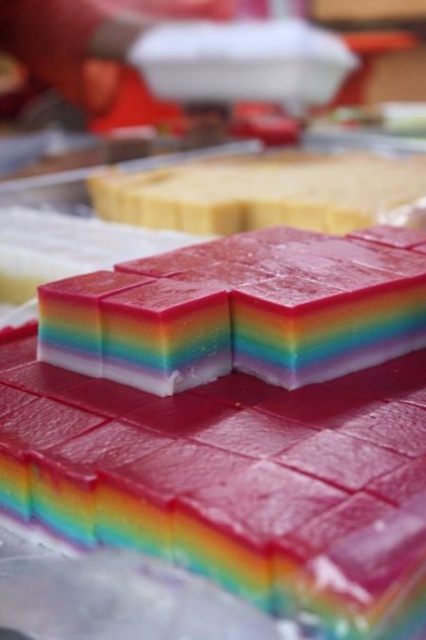
Looking at this image, you are a dessert chef arranging a display. You have two rainbow gelatin desserts in front of you. One is labeled as the rainbow gelatin cube at center and the other is the rainbow gelatin at center. According to the scene, which one is positioned to the left?

The rainbow gelatin cube at center is positioned to the left of the rainbow gelatin at center.

You are a food stylist arranging desserts on a table. You have a rainbow gelatin cube at center and a rainbow gelatin at center in front of you. Which one should you place on the lower shelf if you want the taller dessert to be visible above the shorter one?

The rainbow gelatin cube at center is much taller than the rainbow gelatin at center, so you should place the rainbow gelatin cube at center on the lower shelf so that it can be seen above the shorter one.